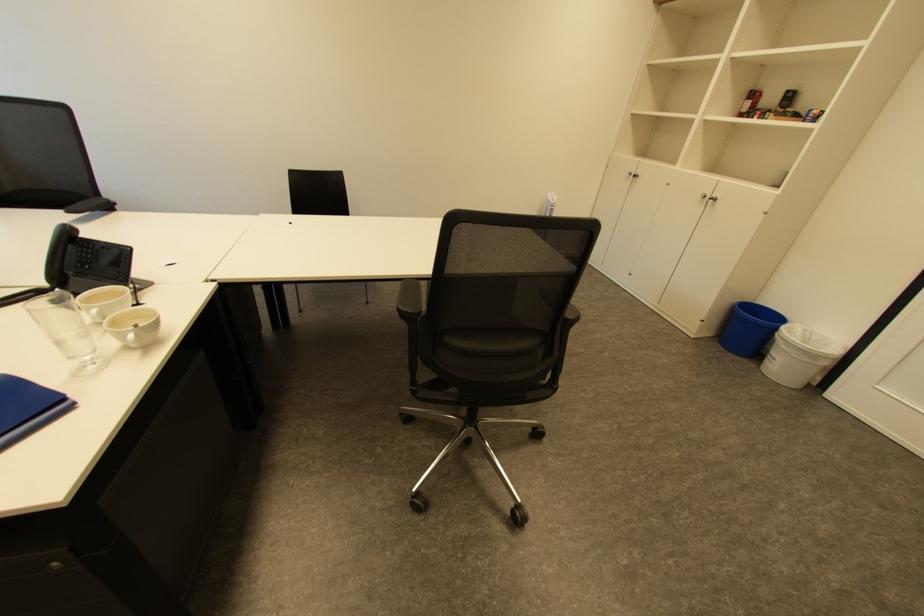
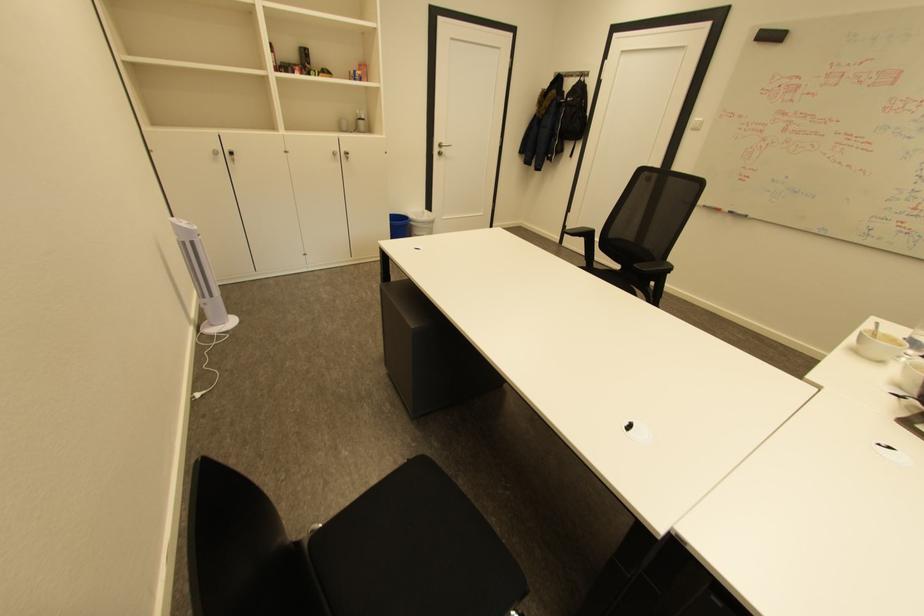
Question: I am providing you with two images of the same scene from different viewpoints. Please identify which objects are invisible in image2.

Choices:
 (A) cabinet drawer lock
 (B) white trash can
 (C) blue trash can
 (D) cabinet door lock

Answer: (C)